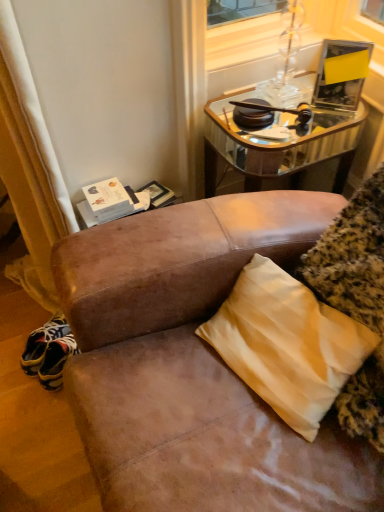
Question: Does yellow satin pillow at lower right turn towards mirrored glass table at upper right?

Choices:
 (A) yes
 (B) no

Answer: (B)

Question: Does yellow satin pillow at lower right have a lesser width compared to mirrored glass table at upper right?

Choices:
 (A) no
 (B) yes

Answer: (B)

Question: Is yellow satin pillow at lower right with mirrored glass table at upper right?

Choices:
 (A) no
 (B) yes

Answer: (A)

Question: Is yellow satin pillow at lower right at the right side of mirrored glass table at upper right?

Choices:
 (A) no
 (B) yes

Answer: (A)

Question: From the image's perspective, is yellow satin pillow at lower right located beneath mirrored glass table at upper right?

Choices:
 (A) no
 (B) yes

Answer: (B)

Question: From a real-world perspective, is yellow satin pillow at lower right physically below mirrored glass table at upper right?

Choices:
 (A) yes
 (B) no

Answer: (B)

Question: Is mirrored glass table at upper right shorter than yellow satin pillow at lower right?

Choices:
 (A) no
 (B) yes

Answer: (A)

Question: Are mirrored glass table at upper right and yellow satin pillow at lower right beside each other?

Choices:
 (A) no
 (B) yes

Answer: (A)

Question: Is mirrored glass table at upper right taller than yellow satin pillow at lower right?

Choices:
 (A) no
 (B) yes

Answer: (B)

Question: From the image's perspective, would you say mirrored glass table at upper right is shown under yellow satin pillow at lower right?

Choices:
 (A) no
 (B) yes

Answer: (A)

Question: Is yellow satin pillow at lower right surrounded by mirrored glass table at upper right?

Choices:
 (A) yes
 (B) no

Answer: (B)

Question: Considering the relative sizes of mirrored glass table at upper right and yellow satin pillow at lower right in the image provided, is mirrored glass table at upper right bigger than yellow satin pillow at lower right?

Choices:
 (A) no
 (B) yes

Answer: (B)

Question: Looking at their shapes, would you say yellow satin pillow at lower right is wider or thinner than mirrored glass table at upper right?

Choices:
 (A) wide
 (B) thin

Answer: (B)